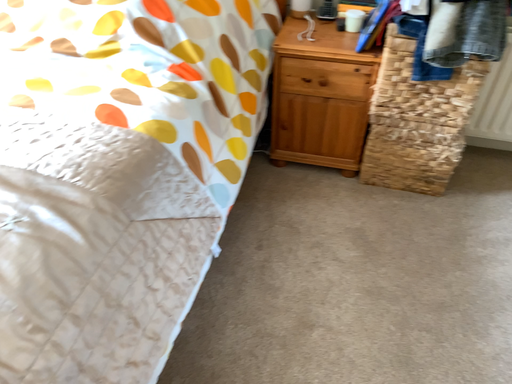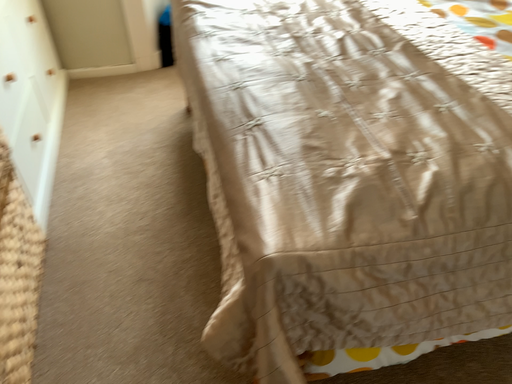
Question: How did the camera likely rotate when shooting the video?

Choices:
 (A) rotated downward
 (B) rotated upward

Answer: (B)